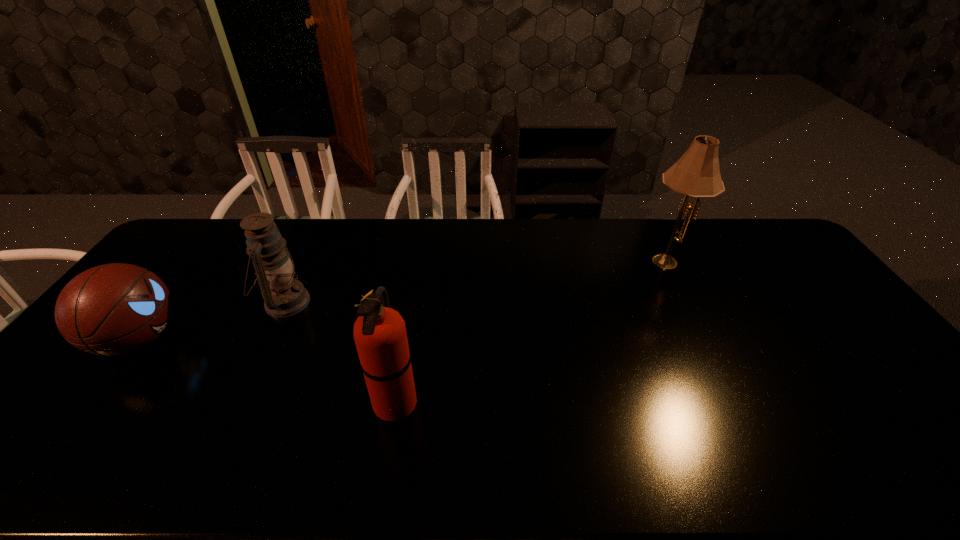
You are a GUI agent. You are given a task and a screenshot of the screen. Output one action in this format:
    pyautogui.click(x=<x>, y=<y>)
    Task: Click on the lampshade
    
    Given the screenshot: What is the action you would take?
    pyautogui.click(x=697, y=174)

You are a GUI agent. You are given a task and a screenshot of the screen. Output one action in this format:
    pyautogui.click(x=<x>, y=<y>)
    Task: Click on the farthest object
    Image resolution: width=960 pixels, height=540 pixels.
    Given the screenshot: What is the action you would take?
    pyautogui.click(x=697, y=174)

Identify the location of the second tallest object. This screenshot has height=540, width=960. (380, 336).

Where is `the third object from left to right`? This screenshot has width=960, height=540. the third object from left to right is located at coordinates pyautogui.click(x=380, y=336).

Find the location of `the second shortest object`. the second shortest object is located at coordinates (284, 296).

You are a GUI agent. You are given a task and a screenshot of the screen. Output one action in this format:
    pyautogui.click(x=<x>, y=<y>)
    Task: Click on the second object from left to right
    The height and width of the screenshot is (540, 960).
    Given the screenshot: What is the action you would take?
    284,296

At what (x,y) coordinates should I click in order to perform the action: click on basketball. Please return your answer as a coordinate pair (x, y). Looking at the image, I should click on (113, 309).

Locate an element on the screen. The image size is (960, 540). the leftmost object is located at coordinates (113, 309).

The image size is (960, 540). I want to click on vacant space located on the back of the rightmost object, so click(651, 228).

Image resolution: width=960 pixels, height=540 pixels. I want to click on vacant space located at the nozzle of the third object from left to right, so 519,402.